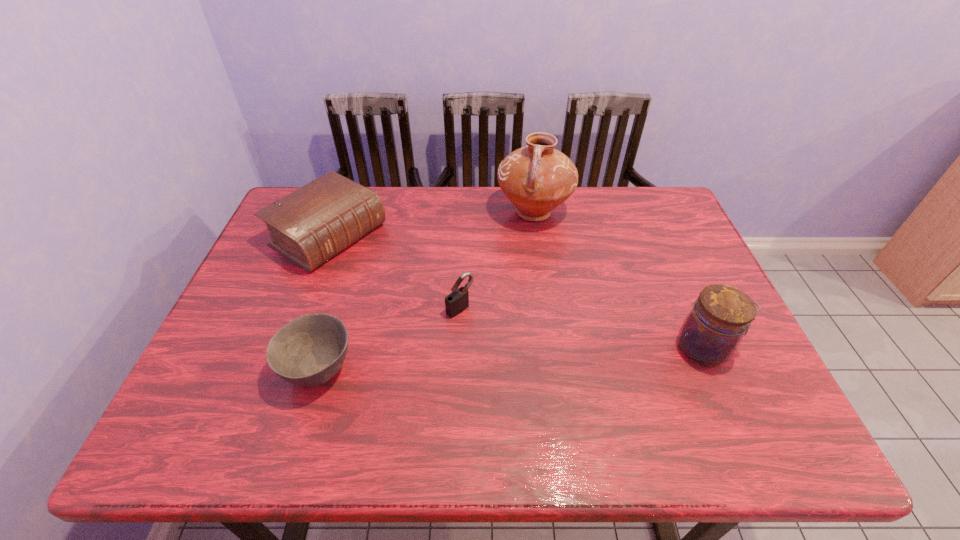
Image resolution: width=960 pixels, height=540 pixels. What are the coordinates of `free location located 0.050m on the side of the fourth object from left to right with the handle` in the screenshot? It's located at (519, 245).

Where is `vacant area situated on the side of the fourth object from left to right with the handle`? The width and height of the screenshot is (960, 540). vacant area situated on the side of the fourth object from left to right with the handle is located at coordinates (502, 283).

What are the coordinates of `vacant position located with the keyhole on the front of the padlock` in the screenshot? It's located at (535, 370).

Locate an element on the screen. This screenshot has width=960, height=540. vacant point located with the keyhole on the front of the padlock is located at coordinates (522, 359).

At what (x,y) coordinates should I click in order to perform the action: click on free space located with the keyhole on the front of the padlock. Please return your answer as a coordinate pair (x, y). The width and height of the screenshot is (960, 540). Looking at the image, I should click on (548, 381).

Image resolution: width=960 pixels, height=540 pixels. I want to click on vacant area situated on the spine side of the Bible, so click(444, 307).

Where is `vacant space situated on the spine side of the Bible`? The height and width of the screenshot is (540, 960). vacant space situated on the spine side of the Bible is located at coordinates (446, 308).

Image resolution: width=960 pixels, height=540 pixels. In order to click on vacant space located on the spine side of the Bible in this screenshot , I will do `click(399, 280)`.

Find the location of `pottery that is at the far edge`. pottery that is at the far edge is located at coordinates (537, 178).

Identify the location of Bible that is at the far edge. 311,225.